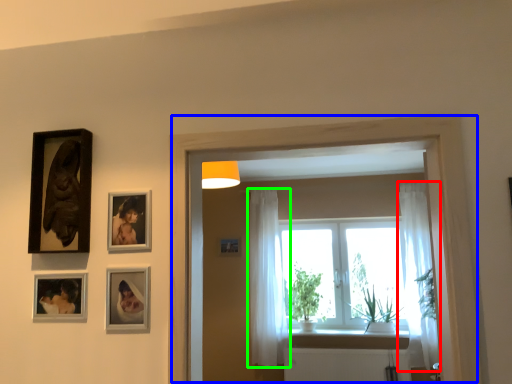
Question: Estimate the real-world distances between objects in this image. Which object is farther from curtain (highlighted by a red box), window frame (highlighted by a blue box) or curtain (highlighted by a green box)?

Choices:
 (A) window frame
 (B) curtain

Answer: (A)